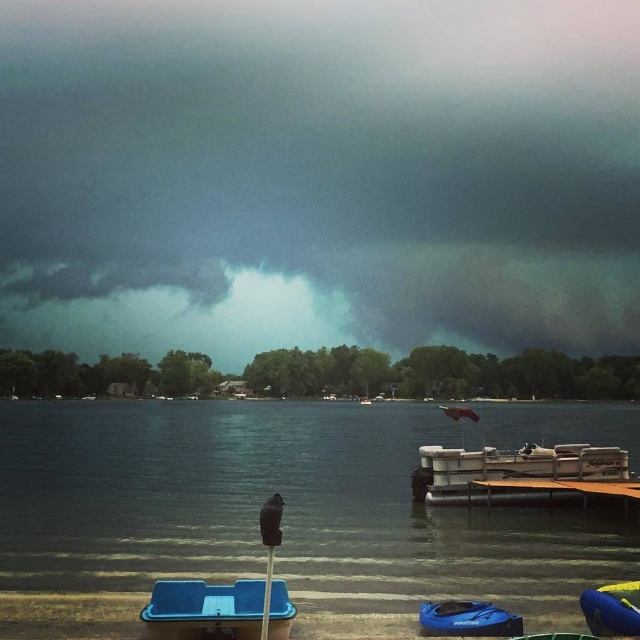
You are a weather observer analyzing the stormy sky in the image. You notice a point marked at coordinates (x=320, y=172). What is the weather feature located at this point?

The point at (x=320, y=172) marks a dark gray cloud at upper center.